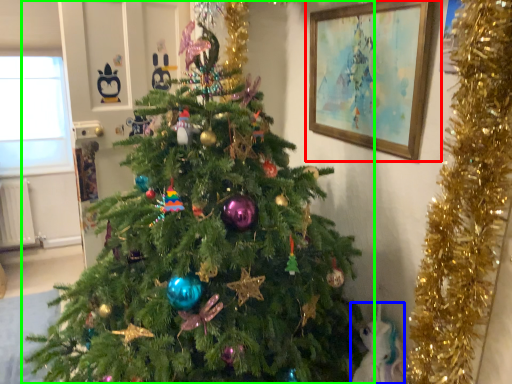
Question: Which object is positioned farthest from picture frame (highlighted by a red box)? Select from animal (highlighted by a blue box) and christmas tree (highlighted by a green box).

Choices:
 (A) animal
 (B) christmas tree

Answer: (A)